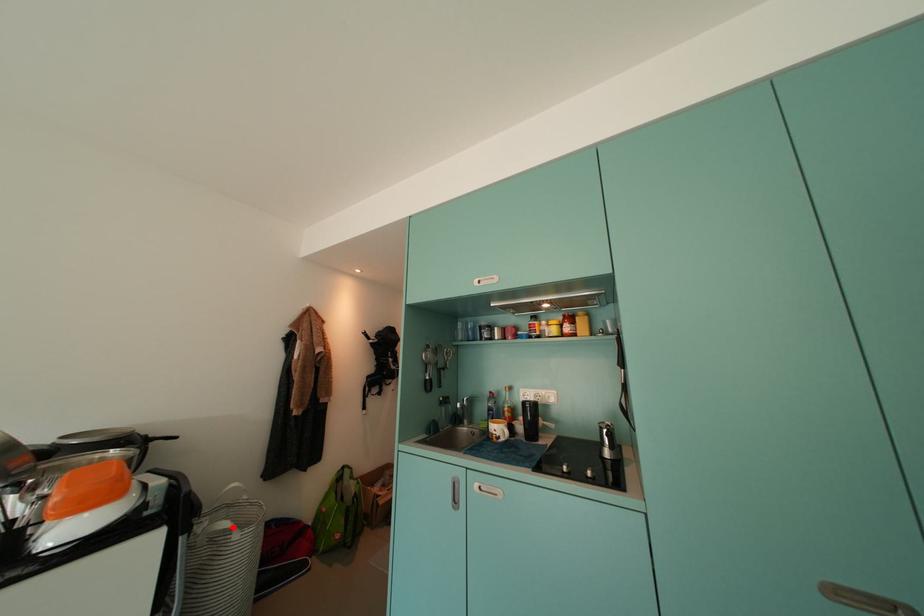
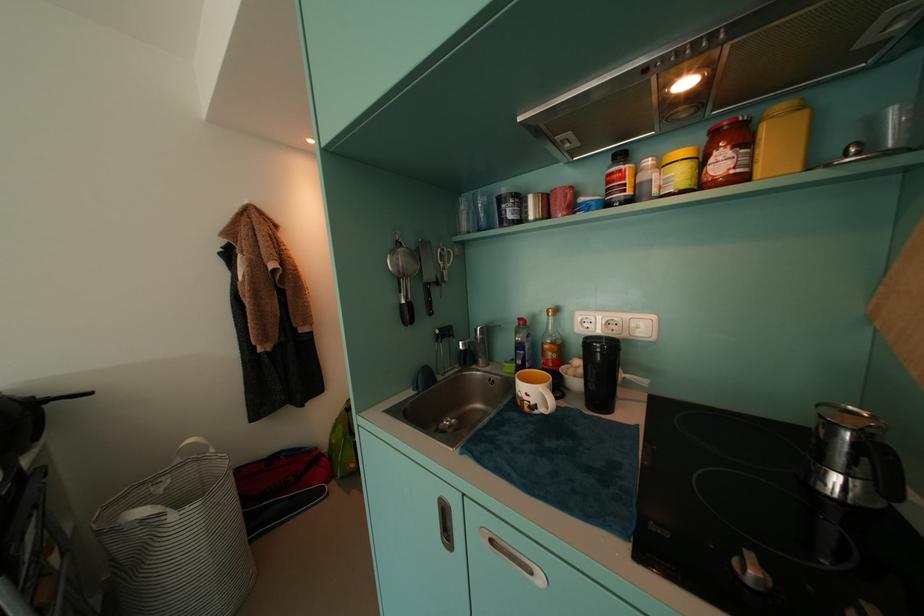
Question: I am providing you with two images of the same scene from different viewpoints. In image1, a red point is highlighted. Considering the same 3D point in image2, which of the following is correct?

Choices:
 (A) It is closer
 (B) It is farther

Answer: (A)